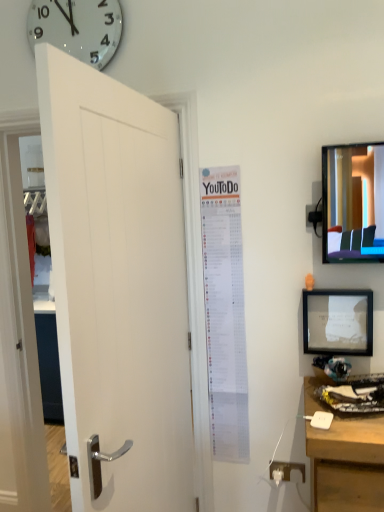
The image size is (384, 512). What do you see at coordinates (225, 313) in the screenshot?
I see `white paper poster at center` at bounding box center [225, 313].

From the picture: What is the approximate height of white plastic outlet at lower right?

It is 3.24 inches.

This screenshot has width=384, height=512. What do you see at coordinates (338, 322) in the screenshot? I see `matte black picture frame at right` at bounding box center [338, 322].

The width and height of the screenshot is (384, 512). What do you see at coordinates (77, 28) in the screenshot? I see `white glossy clock at upper left` at bounding box center [77, 28].

I want to click on white paper poster at center, so click(225, 313).

Considering the sizes of objects matte black picture frame at right and white plastic outlet at lower right in the image provided, who is taller, matte black picture frame at right or white plastic outlet at lower right?

matte black picture frame at right.

Considering the sizes of objects matte black picture frame at right and white plastic outlet at lower right in the image provided, who is bigger, matte black picture frame at right or white plastic outlet at lower right?

Bigger between the two is matte black picture frame at right.

How different are the orientations of matte black picture frame at right and white plastic outlet at lower right in degrees?

The angle between the facing direction of matte black picture frame at right and the facing direction of white plastic outlet at lower right is 0.21 degrees.

From a real-world perspective, which is physically below, matte black picture frame at right or white plastic outlet at lower right?

From a 3D spatial view, white plastic outlet at lower right is below.

Is matte black picture frame at right at the left side of white paper poster at center?

Incorrect, matte black picture frame at right is not on the left side of white paper poster at center.

The width and height of the screenshot is (384, 512). In order to click on picture frame above the white paper poster at center (from the image's perspective) in this screenshot , I will do `click(338, 322)`.

Is matte black picture frame at right located outside white paper poster at center?

Yes, matte black picture frame at right is outside of white paper poster at center.

Is matte black picture frame at right not close to white paper poster at center?

No.

What's the angular difference between white glossy clock at upper left and white plastic outlet at lower right's facing directions?

white glossy clock at upper left and white plastic outlet at lower right are facing 0.927 degrees away from each other.

Is white glossy clock at upper left not within white plastic outlet at lower right?

Absolutely, white glossy clock at upper left is external to white plastic outlet at lower right.

Is white glossy clock at upper left behind white plastic outlet at lower right?

No, white glossy clock at upper left is in front of white plastic outlet at lower right.

From a real-world perspective, which is physically above, white glossy clock at upper left or white plastic outlet at lower right?

white glossy clock at upper left.

Is white plastic outlet at lower right positioned with its back to white glossy clock at upper left?

No, white plastic outlet at lower right is not facing away from white glossy clock at upper left.

Which of these two, white plastic outlet at lower right or white glossy clock at upper left, is bigger?

white glossy clock at upper left is bigger.

Is white plastic outlet at lower right in front of or behind white glossy clock at upper left in the image?

In the image, white plastic outlet at lower right appears behind white glossy clock at upper left.

From their relative heights in the image, would you say white plastic outlet at lower right is taller or shorter than white glossy clock at upper left?

Considering their sizes, white plastic outlet at lower right has less height than white glossy clock at upper left.

In the scene shown: Which of these two, white wooden door at left or matte black picture frame at right, is bigger?

Bigger between the two is white wooden door at left.

From the image's perspective, is white wooden door at left beneath matte black picture frame at right?

Yes.

Which object is thinner, white wooden door at left or matte black picture frame at right?

With smaller width is matte black picture frame at right.

Based on the photo, from a real-world perspective, is white wooden door at left above or below matte black picture frame at right?

white wooden door at left is below matte black picture frame at right.

From the image's perspective, which one is positioned higher, white wooden door at left or white paper poster at center?

From the image's view, white paper poster at center is above.

Is white wooden door at left turned away from white paper poster at center?

No, white wooden door at left is not facing the opposite direction of white paper poster at center.

Considering the positions of objects white wooden door at left and white paper poster at center in the image provided, who is more to the left, white wooden door at left or white paper poster at center?

From the viewer's perspective, white wooden door at left appears more on the left side.

Is white wooden door at left taller than white paper poster at center?

Yes.

Which of these two, white plastic outlet at lower right or white wooden door at left, stands taller?

Standing taller between the two is white wooden door at left.

Is white plastic outlet at lower right closer to the viewer compared to white wooden door at left?

No, the depth of white plastic outlet at lower right is greater than that of white wooden door at left.

Does white plastic outlet at lower right have a smaller size compared to white wooden door at left?

Yes, white plastic outlet at lower right is smaller than white wooden door at left.

In the scene shown: From a real-world perspective, is white plastic outlet at lower right on top of white wooden door at left?

No.

Where is `picture frame above the white plastic outlet at lower right (from a real-world perspective)`? Image resolution: width=384 pixels, height=512 pixels. picture frame above the white plastic outlet at lower right (from a real-world perspective) is located at coordinates (338, 322).

Image resolution: width=384 pixels, height=512 pixels. Identify the location of picture frame on the right side of white paper poster at center. (338, 322).

From the image, which object appears to be nearer to matte black picture frame at right, white plastic outlet at lower right or white glossy clock at upper left?

The object closer to matte black picture frame at right is white plastic outlet at lower right.

Estimate the real-world distances between objects in this image. Which object is closer to white plastic outlet at lower right, matte black picture frame at right or white wooden door at left?

Among the two, matte black picture frame at right is located nearer to white plastic outlet at lower right.

From the image, which object appears to be nearer to white paper poster at center, white wooden door at left or white plastic outlet at lower right?

white wooden door at left is positioned closer to the anchor white paper poster at center.

Considering their positions, is white glossy clock at upper left positioned closer to white paper poster at center than white plastic outlet at lower right?

white plastic outlet at lower right lies closer to white paper poster at center than the other object.

Based on the photo, considering their positions, is matte black picture frame at right positioned closer to white plastic outlet at lower right than white paper poster at center?

Among the two, white paper poster at center is located nearer to white plastic outlet at lower right.

When comparing their distances from white paper poster at center, does matte black picture frame at right or white glossy clock at upper left seem further?

Based on the image, white glossy clock at upper left appears to be further to white paper poster at center.

When comparing their distances from white glossy clock at upper left, does matte black picture frame at right or white plastic outlet at lower right seem closer?

matte black picture frame at right is closer to white glossy clock at upper left.

Considering their positions, is white wooden door at left positioned further to white plastic outlet at lower right than white paper poster at center?

Based on the image, white wooden door at left appears to be further to white plastic outlet at lower right.

Where is `picture frame located between white wooden door at left and white paper poster at center in the depth direction`? The image size is (384, 512). picture frame located between white wooden door at left and white paper poster at center in the depth direction is located at coordinates (338, 322).

This screenshot has width=384, height=512. In order to click on picture frame between white glossy clock at upper left and white plastic outlet at lower right from top to bottom in this screenshot , I will do `click(338, 322)`.

You are a GUI agent. You are given a task and a screenshot of the screen. Output one action in this format:
    pyautogui.click(x=<x>, y=<y>)
    Task: Click on the poster page located between white wooden door at left and white plastic outlet at lower right in the depth direction
    This screenshot has height=512, width=384.
    Given the screenshot: What is the action you would take?
    pyautogui.click(x=225, y=313)

This screenshot has width=384, height=512. I want to click on door between white glossy clock at upper left and white plastic outlet at lower right in the up-down direction, so click(x=118, y=285).